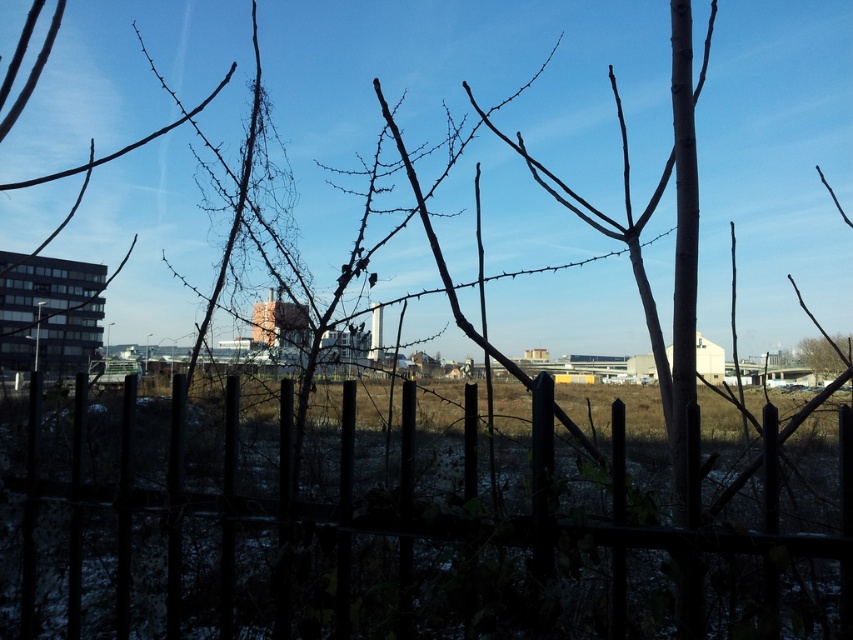
Is point (425, 502) less distant than point (799, 353)?

Yes.

Who is more forward, (131, 452) or (836, 368)?

Positioned in front is point (131, 452).

Is point (186, 547) positioned before point (836, 342)?

Yes, point (186, 547) is closer to viewer.

At what (x,y) coordinates should I click in order to perform the action: click on black metal fence at lower center. Please return your answer as a coordinate pair (x, y). Looking at the image, I should click on (392, 529).